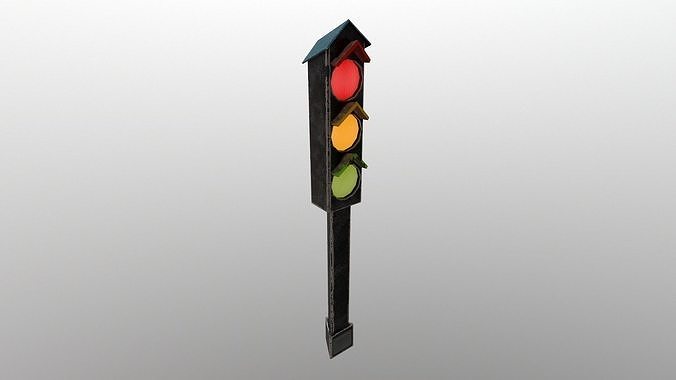
Locate an element on the screen. This screenshot has width=676, height=380. below light is located at coordinates (337, 359).